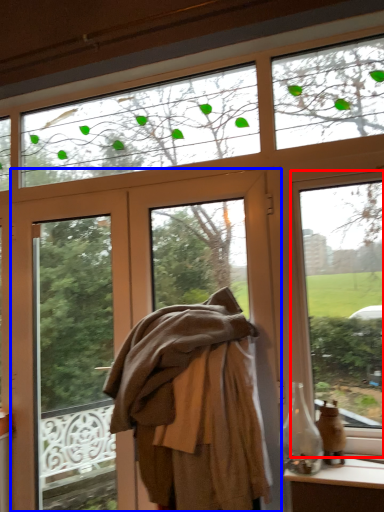
Question: Which point is closer to the camera, window (highlighted by a red box) or door (highlighted by a blue box)?

Choices:
 (A) window
 (B) door

Answer: (A)